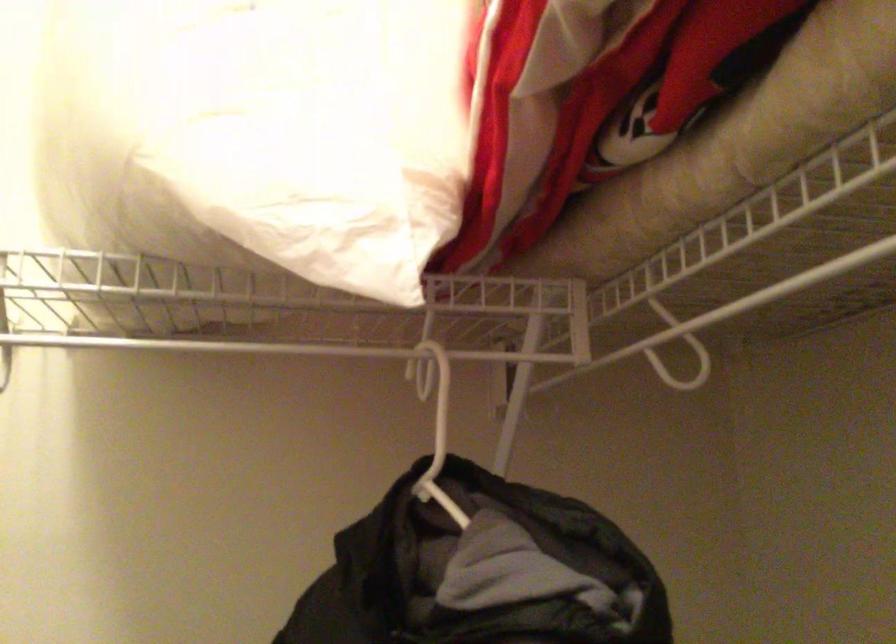
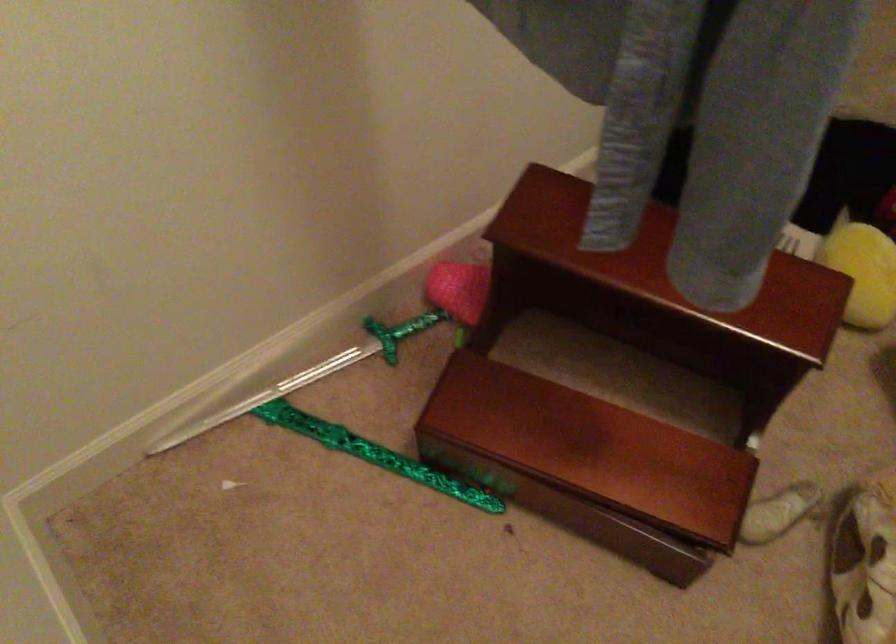
Based on the continuous images, in which direction is the camera rotating?

The rotation direction of the camera is right-down.